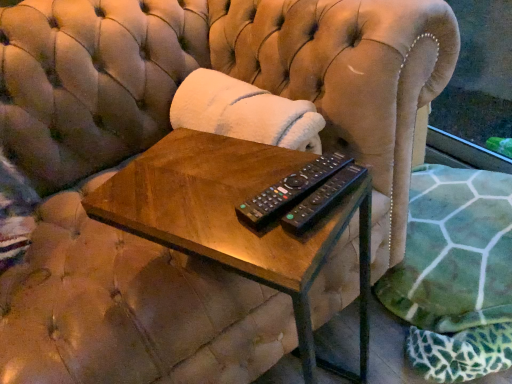
Identify the location of vacant area on top of woodenmaterial/texturetable at center (from a real-world perspective). (220, 185).